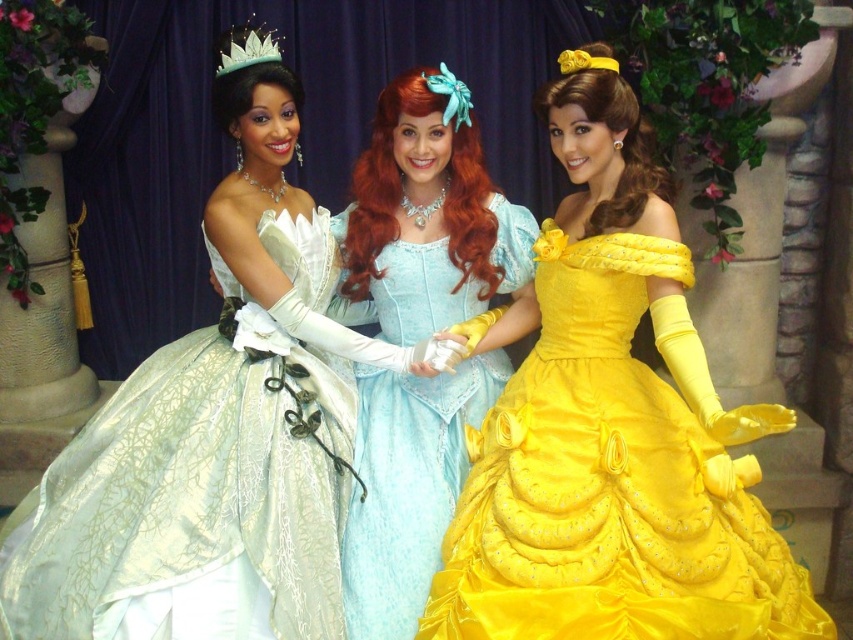
Between light blue satin dress at center and matte silver tiara at upper center, which one has less height?

matte silver tiara at upper center

Is light blue satin dress at center in front of matte silver tiara at upper center?

Yes.

Identify the location of light blue satin dress at center. The image size is (853, 640). (407, 486).

At what (x,y) coordinates should I click in order to perform the action: click on light blue satin dress at center. Please return your answer as a coordinate pair (x, y). The width and height of the screenshot is (853, 640). Looking at the image, I should click on (407, 486).

Is matte silver gown at center taller than yellow satin tiara at upper center?

Yes, matte silver gown at center is taller than yellow satin tiara at upper center.

What do you see at coordinates (421, 333) in the screenshot? I see `matte silver gown at center` at bounding box center [421, 333].

At what (x,y) coordinates should I click in order to perform the action: click on matte silver gown at center. Please return your answer as a coordinate pair (x, y). The width and height of the screenshot is (853, 640). Looking at the image, I should click on pyautogui.click(x=421, y=333).

Is matte green gown at center smaller than matte silver gown at center?

Actually, matte green gown at center might be larger than matte silver gown at center.

Who is more distant from viewer, (x=325, y=394) or (x=379, y=378)?

A: Positioned behind is point (x=379, y=378).

At what (x,y) coordinates should I click in order to perform the action: click on matte green gown at center. Please return your answer as a coordinate pair (x, y). Looking at the image, I should click on (215, 435).